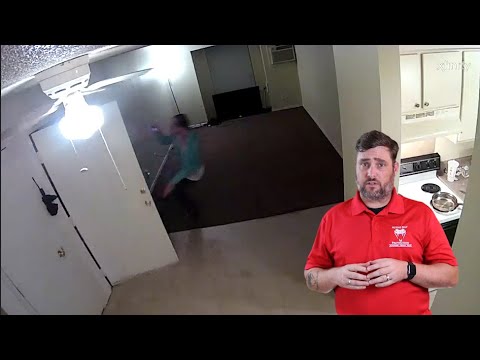
Where is `wooden tile floor`? wooden tile floor is located at coordinates (281, 308).